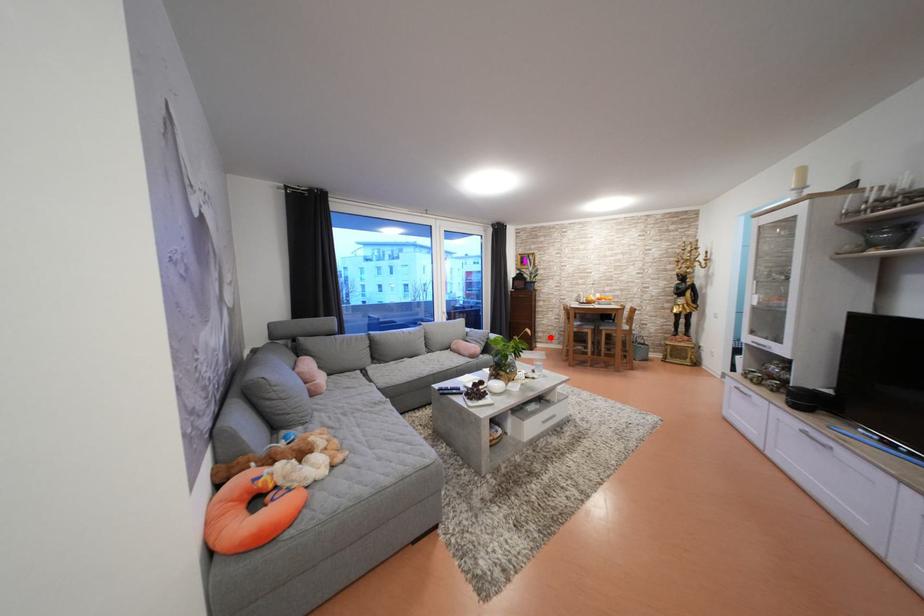
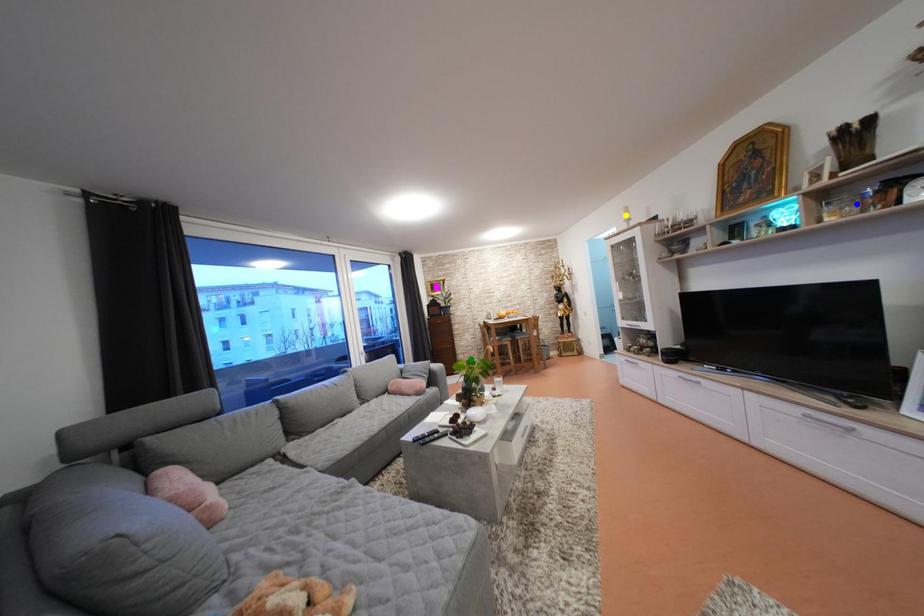
Question: I am providing you with two images of the same scene from different viewpoints. A red point is marked on the first image. You are given multiple points on the second image. Which point in image 2 is actually the same real-world point as the red point in image 1?

Choices:
 (A) yellow point
 (B) blue point
 (C) green point

Answer: (C)